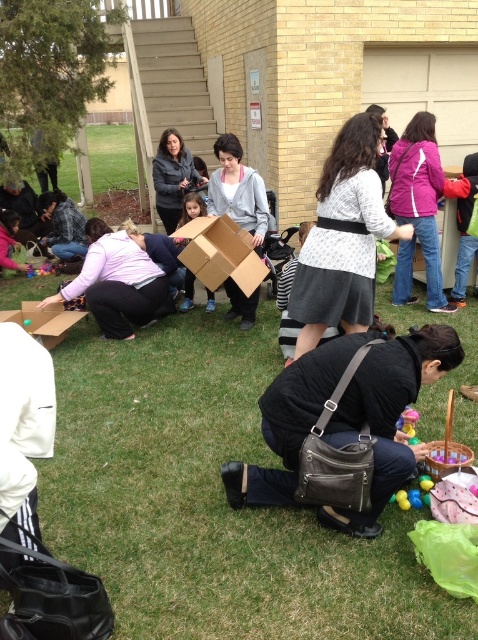
Question: Does cardboard box at lower left appear over matte cardboard box at center?

Choices:
 (A) no
 (B) yes

Answer: (A)

Question: Estimate the real-world distances between objects in this image. Which object is closer to the cardboard box at center?

Choices:
 (A) matte cardboard box at center
 (B) cardboard box at lower left

Answer: (A)

Question: Which object is positioned farthest from the cardboard box at center?

Choices:
 (A) matte cardboard box at center
 (B) cardboard box at lower left

Answer: (B)

Question: Which point appears closest to the camera in this image?

Choices:
 (A) (254, 284)
 (B) (21, 316)

Answer: (A)

Question: Can you confirm if cardboard box at center is thinner than cardboard box at lower left?

Choices:
 (A) no
 (B) yes

Answer: (B)

Question: Does cardboard box at center have a greater width compared to cardboard box at lower left?

Choices:
 (A) no
 (B) yes

Answer: (A)